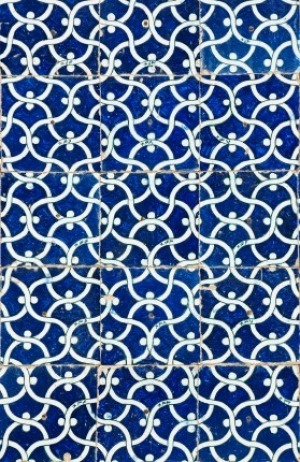
Find the location of `top left tile`. top left tile is located at coordinates (57, 35).